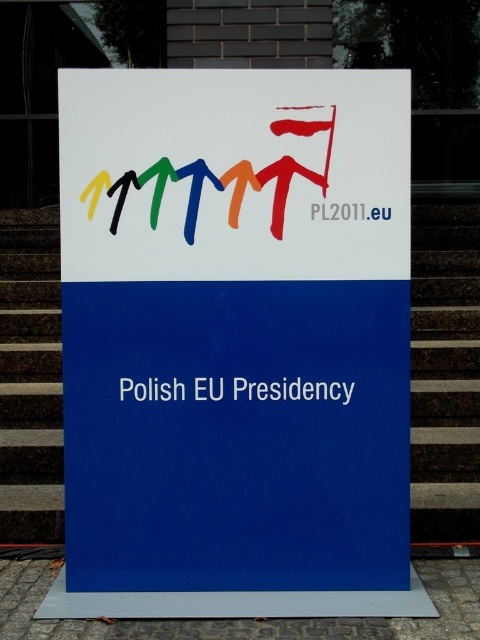
Question: Among these points, which one is nearest to the camera?

Choices:
 (A) (x=81, y=266)
 (B) (x=335, y=113)

Answer: (B)

Question: Is white paper sign at center to the right of brown textured stairs at left from the viewer's perspective?

Choices:
 (A) yes
 (B) no

Answer: (A)

Question: Does white paper sign at center appear under brown textured stairs at left?

Choices:
 (A) yes
 (B) no

Answer: (B)

Question: Which point appears farthest from the camera in this image?

Choices:
 (A) (460, 273)
 (B) (46, 296)
 (C) (202, 164)
 (D) (126, 96)

Answer: (A)

Question: Which point is closer to the camera taking this photo?

Choices:
 (A) (302, 106)
 (B) (460, 372)
 (C) (15, 275)
 (D) (408, 323)

Answer: (A)

Question: Can you confirm if dark brown wooden stairs at right is smaller than multicolored plastic logo at center?

Choices:
 (A) no
 (B) yes

Answer: (A)